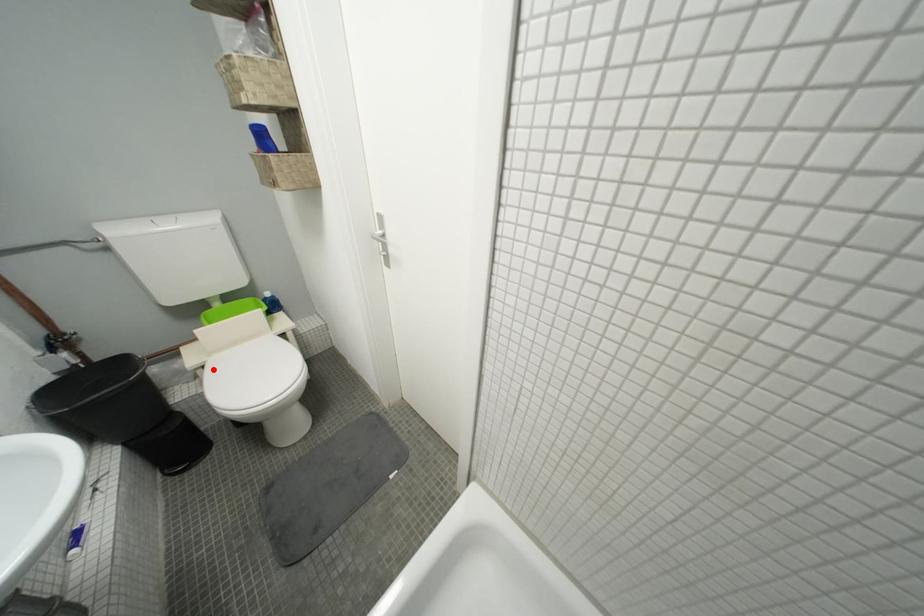
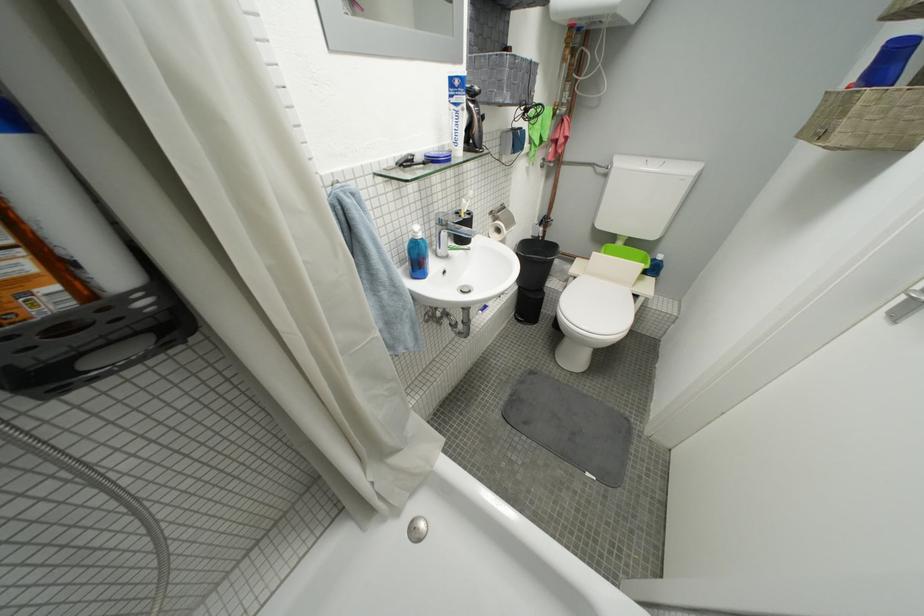
Locate, in the second image, the point that corresponds to the highlighted location in the first image.

(584, 281)